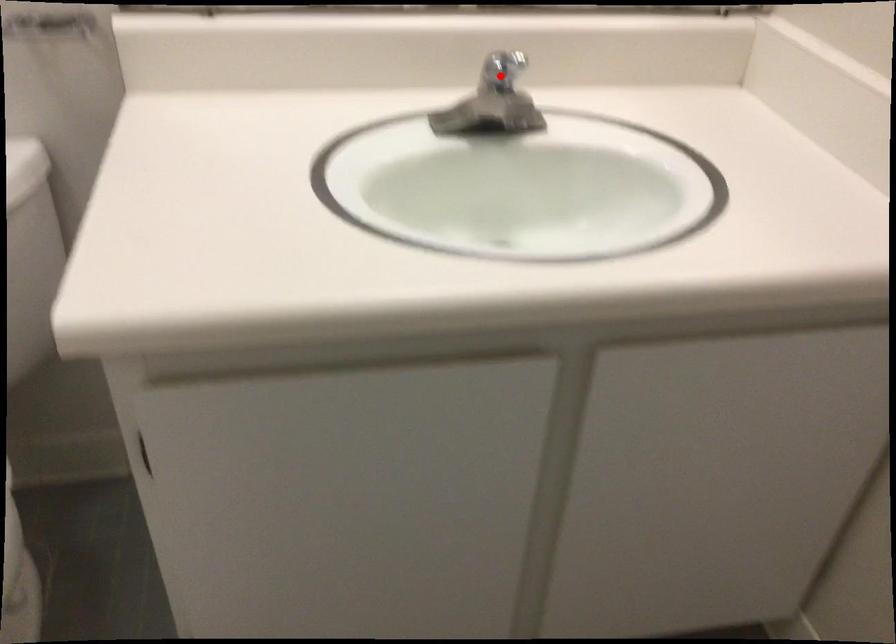
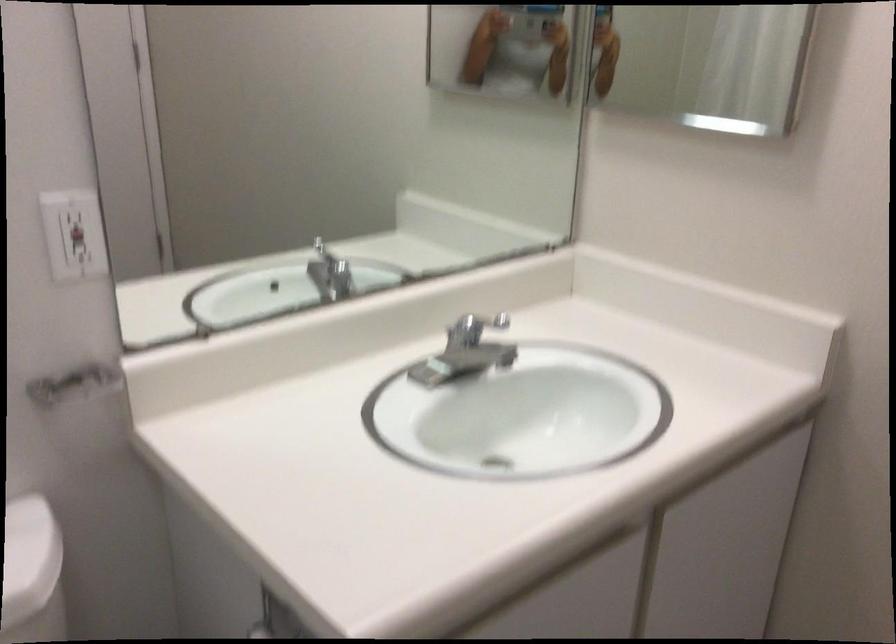
The point at the highlighted location is marked in the first image. Where is the corresponding point in the second image?

(474, 328)